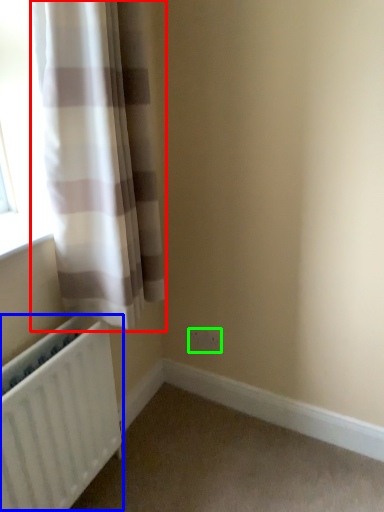
Question: Which object is the farthest from curtain (highlighted by a red box)? Choose among these: radiator (highlighted by a blue box) or electric outlet (highlighted by a green box).

Choices:
 (A) radiator
 (B) electric outlet

Answer: (B)